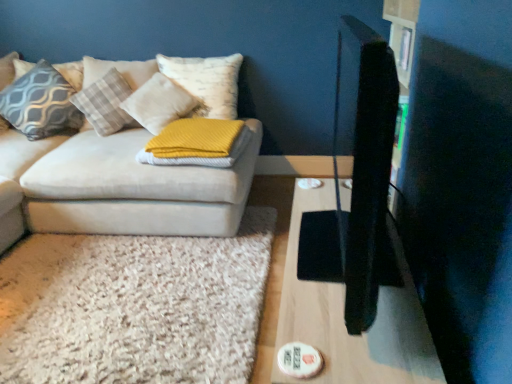
Question: Should I look upward or downward to see yellow knitted blanket at center, which ranks as the 5th pillow in left-to-right order?

Choices:
 (A) up
 (B) down

Answer: (A)

Question: From the image's perspective, is patterned fabric pillow at upper left, placed as the 5th pillow when sorted from right to left, under white shaggy rug at lower left?

Choices:
 (A) no
 (B) yes

Answer: (A)

Question: Is patterned fabric pillow at upper left, which appears as the 1th pillow when viewed from the left, at the right side of white shaggy rug at lower left?

Choices:
 (A) no
 (B) yes

Answer: (A)

Question: Does patterned fabric pillow at upper left, placed as the 5th pillow when sorted from right to left, lie in front of white shaggy rug at lower left?

Choices:
 (A) no
 (B) yes

Answer: (A)

Question: Is patterned fabric pillow at upper left, placed as the 5th pillow when sorted from right to left, beside white shaggy rug at lower left?

Choices:
 (A) no
 (B) yes

Answer: (A)

Question: Is patterned fabric pillow at upper left, placed as the 5th pillow when sorted from right to left, not within white shaggy rug at lower left?

Choices:
 (A) yes
 (B) no

Answer: (A)

Question: From the image's perspective, is patterned fabric pillow at upper left, placed as the 5th pillow when sorted from right to left, on white shaggy rug at lower left?

Choices:
 (A) yes
 (B) no

Answer: (A)

Question: Does plush white pillow at upper left, the third pillow when ordered from left to right, turn towards patterned fabric pillow at upper left, placed as the 5th pillow when sorted from right to left?

Choices:
 (A) no
 (B) yes

Answer: (A)

Question: Can you confirm if plush white pillow at upper left, the third pillow when ordered from left to right, is positioned to the left of patterned fabric pillow at upper left, which appears as the 1th pillow when viewed from the left?

Choices:
 (A) yes
 (B) no

Answer: (B)

Question: Is plush white pillow at upper left, which is the 3th pillow from right to left, facing away from patterned fabric pillow at upper left, placed as the 5th pillow when sorted from right to left?

Choices:
 (A) no
 (B) yes

Answer: (A)

Question: Can you confirm if plush white pillow at upper left, which is the 3th pillow from right to left, is bigger than patterned fabric pillow at upper left, which appears as the 1th pillow when viewed from the left?

Choices:
 (A) yes
 (B) no

Answer: (A)

Question: Does plush white pillow at upper left, which is the 3th pillow from right to left, have a lesser height compared to patterned fabric pillow at upper left, placed as the 5th pillow when sorted from right to left?

Choices:
 (A) no
 (B) yes

Answer: (A)

Question: From a real-world perspective, is plush white pillow at upper left, the third pillow when ordered from left to right, on top of patterned fabric pillow at upper left, which appears as the 1th pillow when viewed from the left?

Choices:
 (A) no
 (B) yes

Answer: (A)

Question: Does velvet beige couch at left appear on the right side of wooden table at right?

Choices:
 (A) yes
 (B) no

Answer: (B)